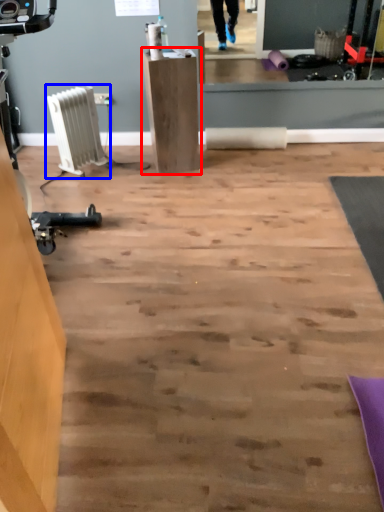
Question: Among these objects, which one is farthest to the camera, furniture (highlighted by a red box) or radiator (highlighted by a blue box)?

Choices:
 (A) furniture
 (B) radiator

Answer: (B)